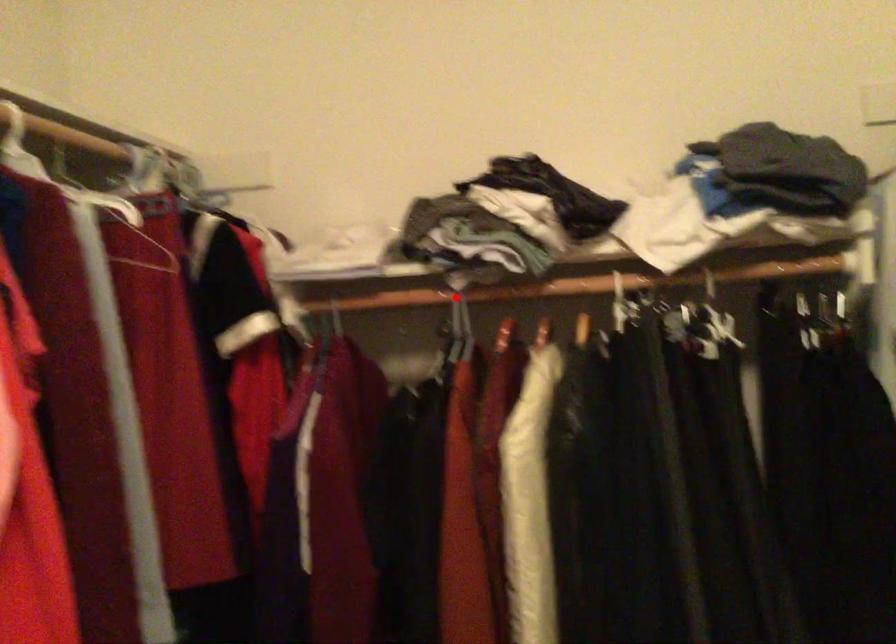
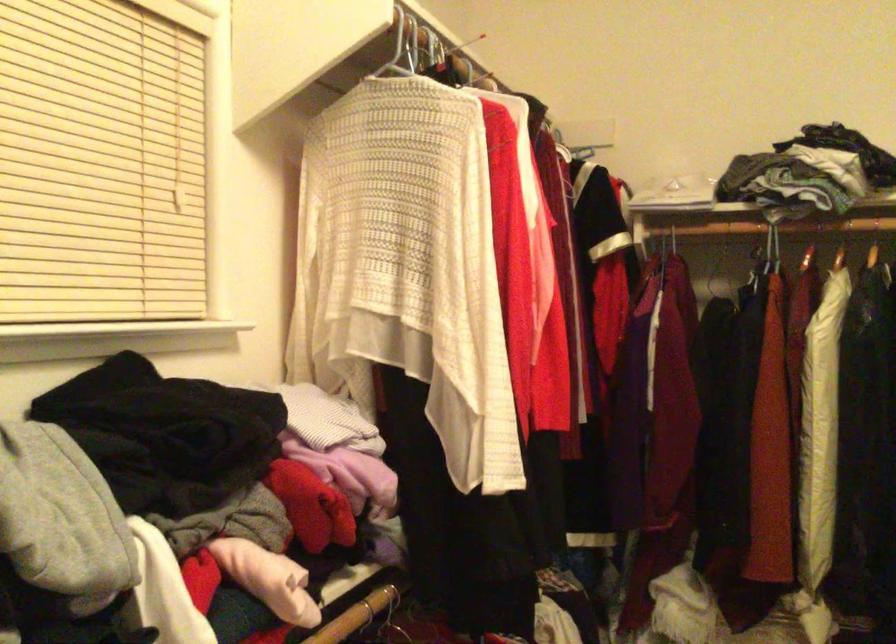
Question: I am providing you with two images of the same scene from different viewpoints. A red point is shown in image1. For the corresponding object point in image2, is it positioned nearer or farther from the camera?

Choices:
 (A) Nearer
 (B) Farther

Answer: (B)